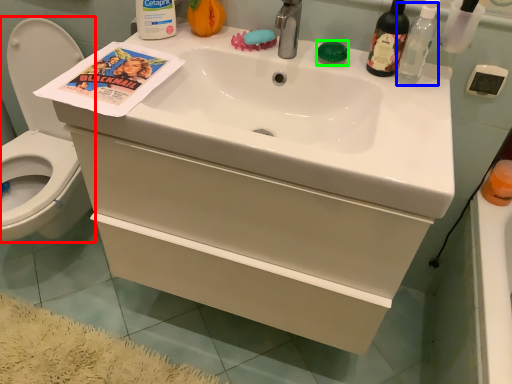
Question: Estimate the real-world distances between objects in this image. Which object is farther from toilet (highlighted by a red box), bottle (highlighted by a blue box) or soap (highlighted by a green box)?

Choices:
 (A) bottle
 (B) soap

Answer: (A)